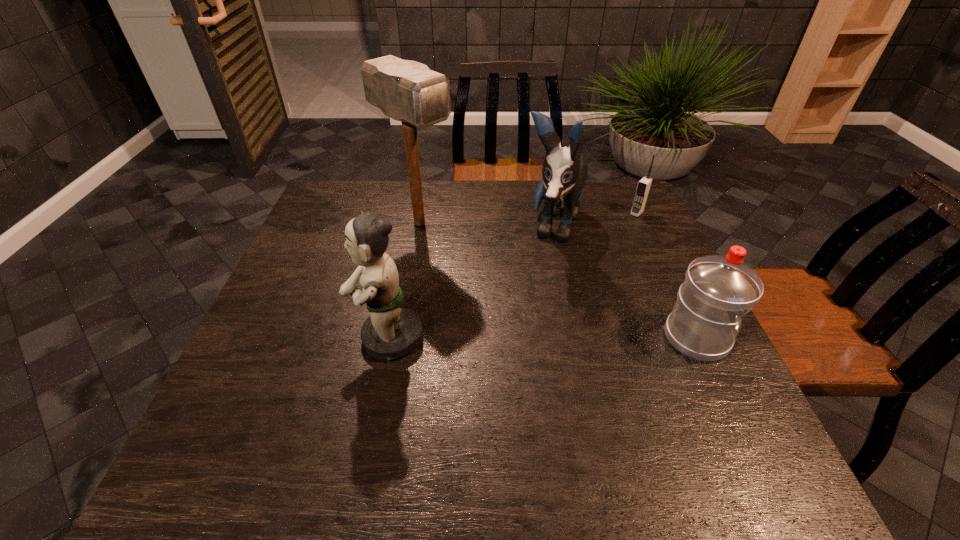
Find the location of `vacant space on the desktop that is between the figurine and the second shortest object and is positioned on the front-facing side of the third object from right to left`. vacant space on the desktop that is between the figurine and the second shortest object and is positioned on the front-facing side of the third object from right to left is located at coordinates (505, 338).

At what (x,y) coordinates should I click in order to perform the action: click on free space on the desktop that is between the third tallest object and the water bottle and is positioned on the front-facing side of the shortest object. Please return your answer as a coordinate pair (x, y). The width and height of the screenshot is (960, 540). Looking at the image, I should click on (514, 338).

Where is `free space on the desktop that is between the third shortest object and the water bottle and is positioned on the striking face of the mallet`? free space on the desktop that is between the third shortest object and the water bottle and is positioned on the striking face of the mallet is located at coordinates (586, 338).